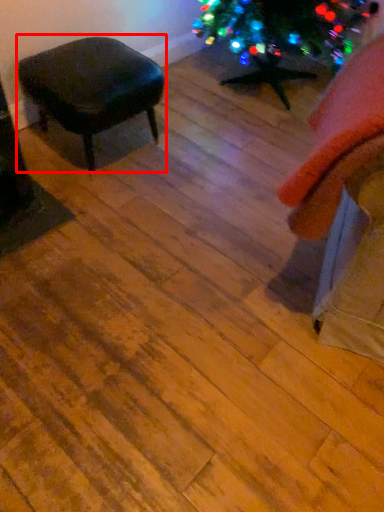
Question: In this image, where is stool (annotated by the red box) located relative to swivel chair?

Choices:
 (A) right
 (B) left

Answer: (B)